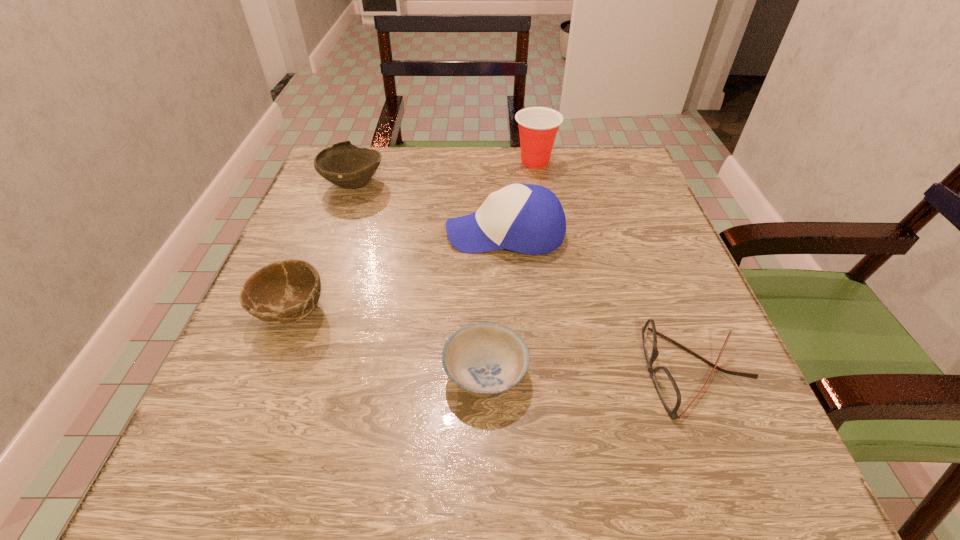
Where is `free location located 0.140m on the front-facing side of the baseball cap`? free location located 0.140m on the front-facing side of the baseball cap is located at coordinates (379, 233).

Where is `free space located 0.330m on the front of the farthest bowl`? The height and width of the screenshot is (540, 960). free space located 0.330m on the front of the farthest bowl is located at coordinates (305, 315).

Where is `free spot located on the right of the second nearest bowl`? The width and height of the screenshot is (960, 540). free spot located on the right of the second nearest bowl is located at coordinates (420, 312).

This screenshot has height=540, width=960. Find the location of `vacant region located on the front of the rightmost bowl`. vacant region located on the front of the rightmost bowl is located at coordinates (487, 494).

What are the coordinates of `free space located on the front-facing side of the spectacles` in the screenshot? It's located at (471, 372).

This screenshot has height=540, width=960. What are the coordinates of `free space located 0.100m on the front-facing side of the spectacles` in the screenshot? It's located at (582, 372).

The image size is (960, 540). Find the location of `free space located 0.320m on the front-facing side of the spectacles`. free space located 0.320m on the front-facing side of the spectacles is located at coordinates (439, 372).

I want to click on cup at the far edge, so click(538, 126).

Identify the location of bowl that is at the far edge. The width and height of the screenshot is (960, 540). (343, 164).

Locate an element on the screen. The width and height of the screenshot is (960, 540). object situated at the right edge is located at coordinates (667, 389).